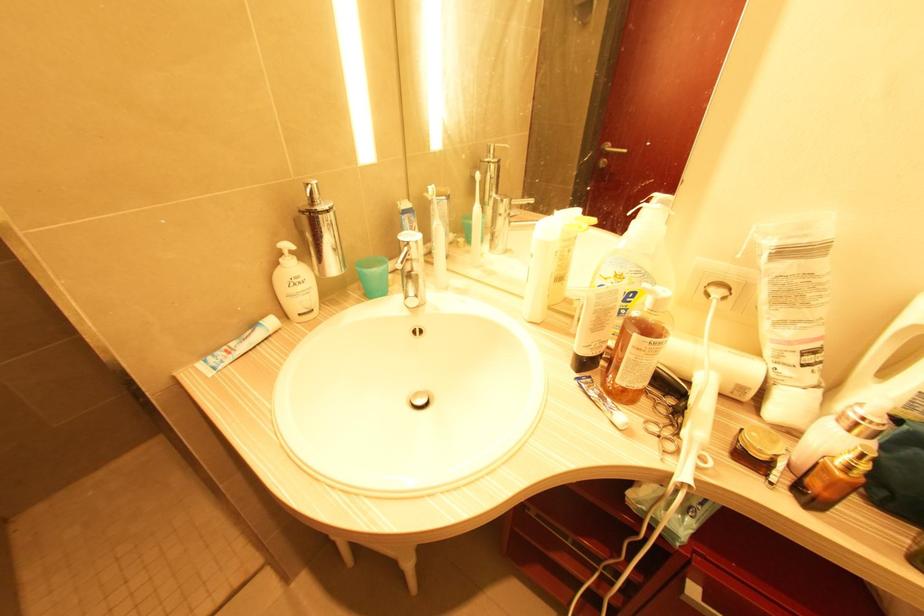
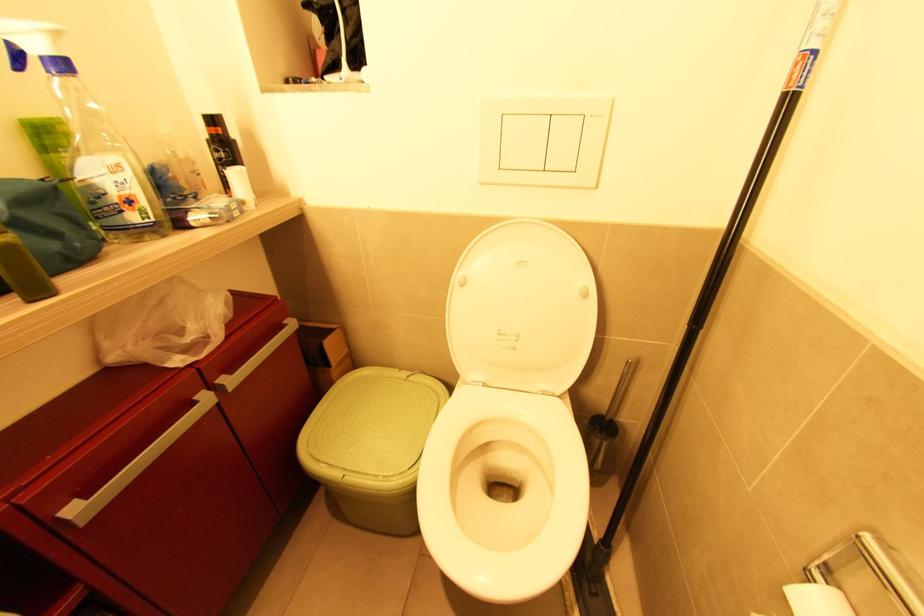
The images are taken continuously from a first-person perspective. In which direction is your viewpoint rotating?

The camera rotated toward right-down.